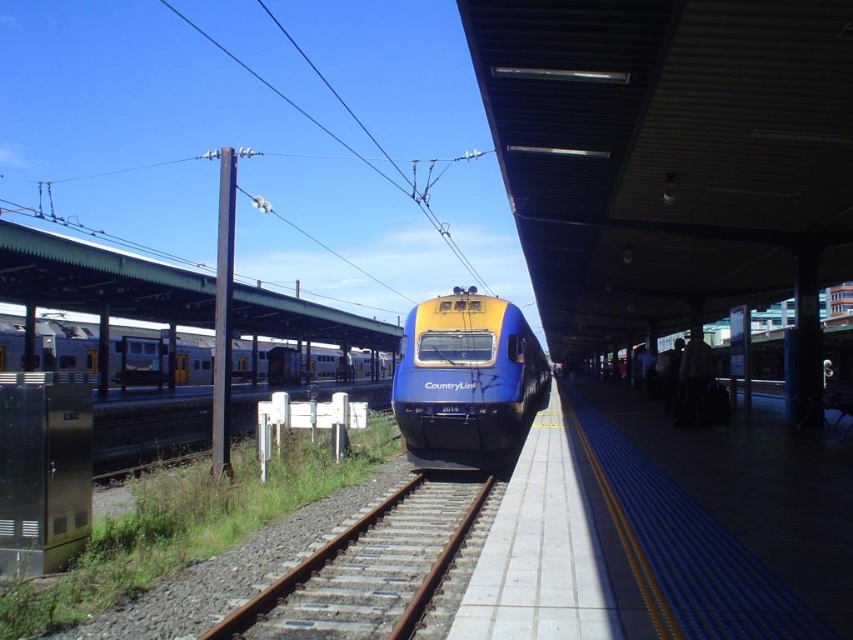
Does blue glossy train at center have a lesser width compared to silver metallic train at left?

Yes.

Who is lower down, blue glossy train at center or silver metallic train at left?

silver metallic train at left is below.

Is point (415, 445) positioned in front of point (4, 323)?

Yes, it is in front of point (4, 323).

Locate an element on the screen. The height and width of the screenshot is (640, 853). blue glossy train at center is located at coordinates (466, 381).

Is rusty metal train track at center shorter than blue glossy train at center?

Yes.

Is point (393, 552) closer to camera compared to point (439, 461)?

Yes, point (393, 552) is in front of point (439, 461).

Is point (283, 602) positioned before point (471, 460)?

Yes.

The height and width of the screenshot is (640, 853). I want to click on rusty metal train track at center, so click(366, 570).

Who is positioned more to the right, rusty metal train track at center or silver metallic train at left?

rusty metal train track at center

Does rusty metal train track at center have a greater height compared to silver metallic train at left?

No, rusty metal train track at center is not taller than silver metallic train at left.

The width and height of the screenshot is (853, 640). In order to click on rusty metal train track at center in this screenshot , I will do `click(366, 570)`.

Image resolution: width=853 pixels, height=640 pixels. In order to click on rusty metal train track at center in this screenshot , I will do `click(366, 570)`.